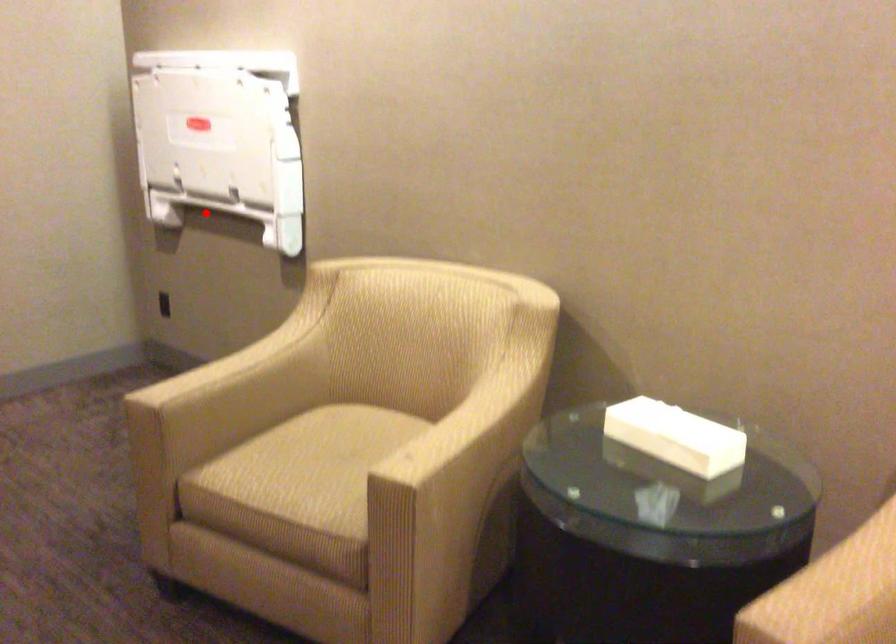
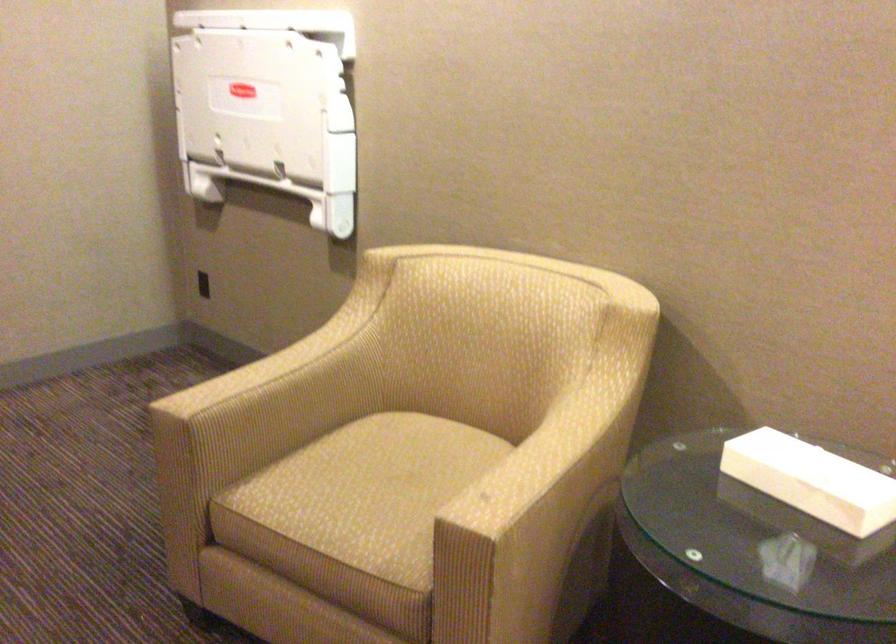
Find the pixel in the second image that matches the highlighted location in the first image.

(248, 187)